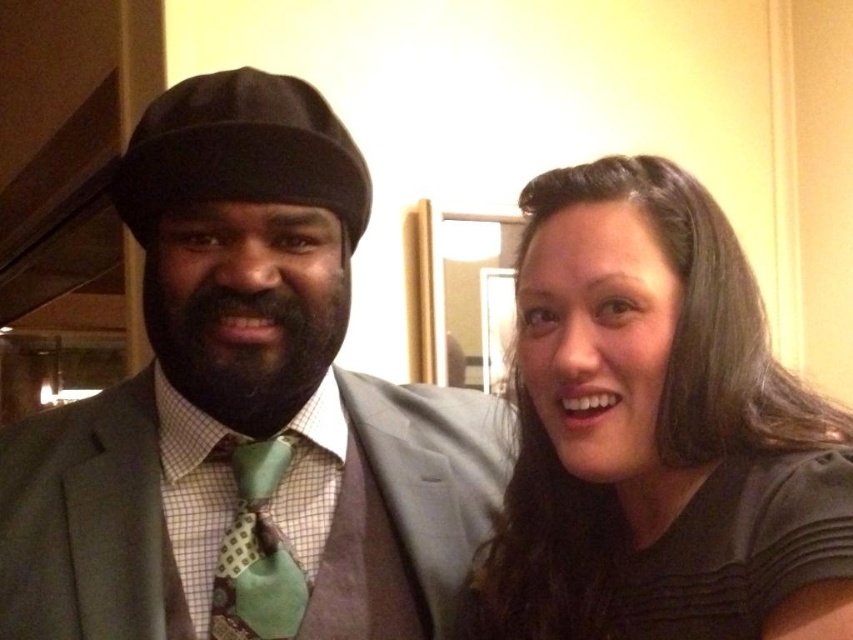
Can you confirm if black matte dress at right is taller than black fuzzy beard at center?

Indeed, black matte dress at right has a greater height compared to black fuzzy beard at center.

Can you confirm if black matte dress at right is wider than black fuzzy beard at center?

Correct, the width of black matte dress at right exceeds that of black fuzzy beard at center.

Between point (717, 627) and point (337, 310), which one is positioned behind?

The point (337, 310) is more distant.

What are the coordinates of `black matte dress at right` in the screenshot? It's located at (737, 548).

Does black matte hair at upper right have a greater height compared to green textured tie at center?

Yes, black matte hair at upper right is taller than green textured tie at center.

Consider the image. Is black matte hair at upper right below green textured tie at center?

No, black matte hair at upper right is not below green textured tie at center.

Find the location of a particular element. This screenshot has width=853, height=640. black matte hair at upper right is located at coordinates (659, 432).

Identify the location of black matte hair at upper right. The image size is (853, 640). (659, 432).

Between black matte hair at upper right and black matte dress at right, which one has less height?

Standing shorter between the two is black matte dress at right.

Is point (541, 556) positioned in front of point (836, 534)?

No, it is behind (836, 534).

Which is behind, point (809, 518) or point (741, 611)?

Point (741, 611)

Where is `black matte hair at upper right`? This screenshot has height=640, width=853. black matte hair at upper right is located at coordinates (659, 432).